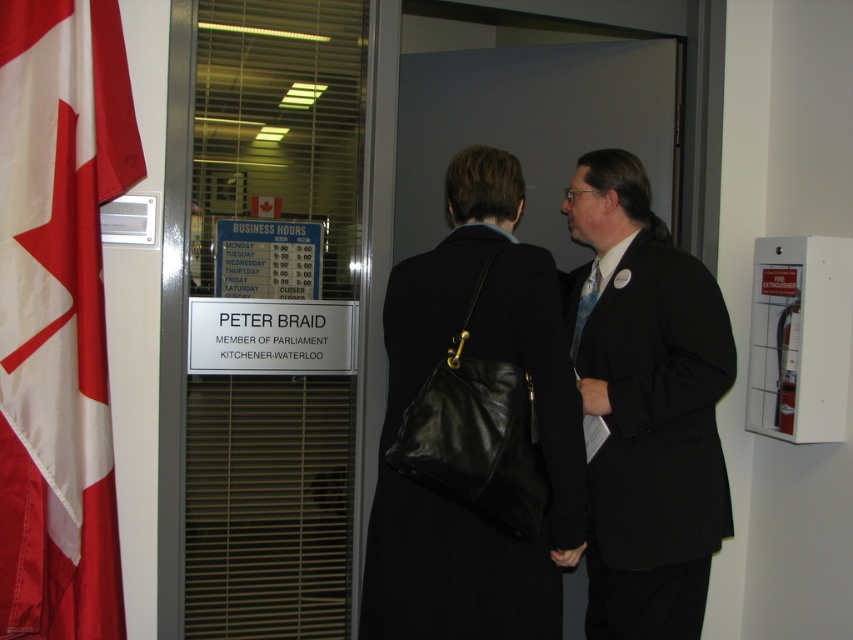
You are a visitor at the parliamentary office and need to find the flag of Canada. You see the red cloth flag at left and the black leather handbag at center. Which object is smaller?

The red cloth flag at left is smaller than the black leather handbag at center.

You are a photographer who needs to take a photo of the matte black coat at center from a distance of 2 meters. Can you position yourself at the camera location to achieve this?

The distance between the matte black coat at center and the camera is 1.98 meters, so yes, you can position yourself at the camera location to take the photo as it is just slightly under the required 2 meters.